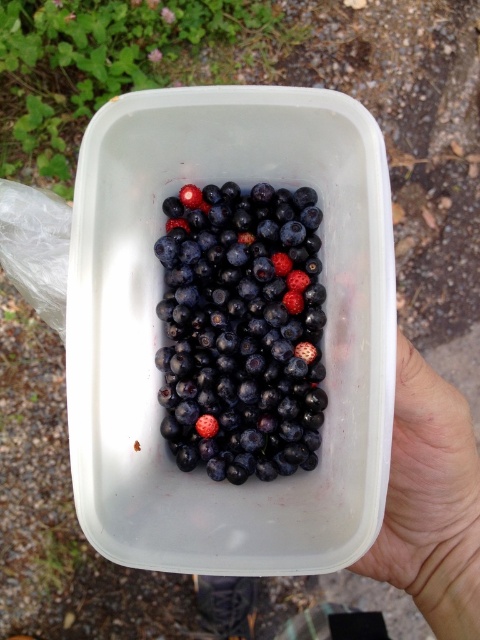
You are a fruit inspector checking the freshness of berries. You notice the white smooth hand at lower right and the glossy blueberry at center. Which object is nearer to your eyes?

The white smooth hand at lower right is closer to the viewer than the glossy blueberry at center.

You are a berry picker trying to pick the berries closest to you. You have a basket that can only hold berries within a 5 inch radius. Are both the shiny dark blue berries at center and the glossy blueberry at center within your basket range?

The shiny dark blue berries at center is 4.92 inches away from glossy blueberry at center. Since the distance between them is less than 5 inches, both berries are within the basket range.

You are a berry farmer inspecting the container. You need to determine if the shiny dark blue berries at center will fit into a storage box that requires the height of the berries to be less than the white smooth hand at lower right. Can they fit?

The shiny dark blue berries at center is taller than the white smooth hand at lower right, so they will not fit into the storage box that requires the height to be less than the hand.